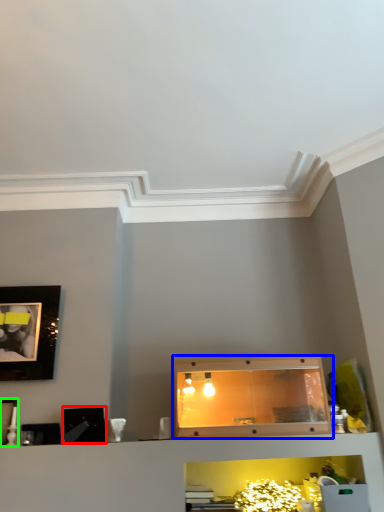
Question: Which object is the farthest from picture frame (highlighted by a red box)? Choose among these: cabinetry (highlighted by a blue box) or picture frame (highlighted by a green box).

Choices:
 (A) cabinetry
 (B) picture frame

Answer: (A)